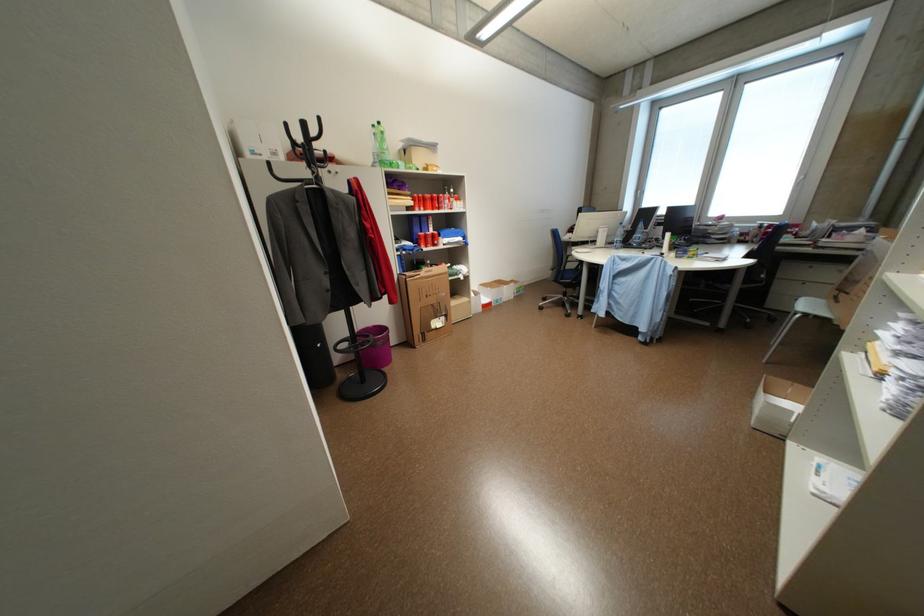
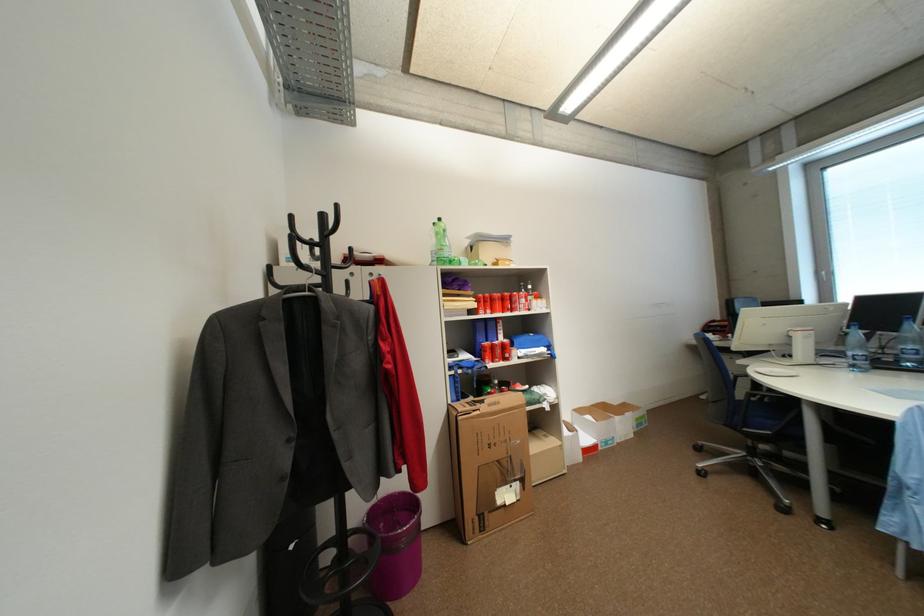
The point at (434, 237) is marked in the first image. Where is the corresponding point in the second image?

(502, 347)